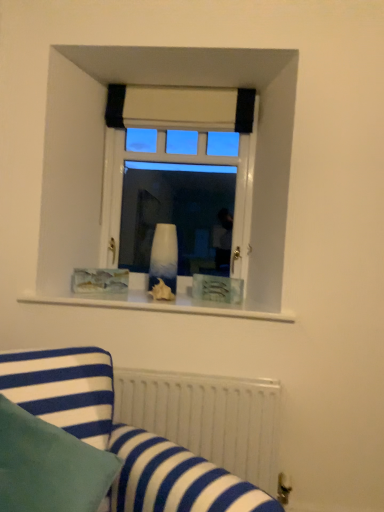
Question: Does blue striped fabric at lower left lie behind white matte radiator at lower center?

Choices:
 (A) no
 (B) yes

Answer: (A)

Question: Can we say blue striped fabric at lower left lies outside white matte radiator at lower center?

Choices:
 (A) no
 (B) yes

Answer: (B)

Question: From a real-world perspective, does blue striped fabric at lower left stand above white matte radiator at lower center?

Choices:
 (A) no
 (B) yes

Answer: (B)

Question: Is blue striped fabric at lower left positioned in front of white matte radiator at lower center?

Choices:
 (A) no
 (B) yes

Answer: (B)

Question: Is blue striped fabric at lower left aimed at white matte radiator at lower center?

Choices:
 (A) no
 (B) yes

Answer: (A)

Question: From a real-world perspective, is blue striped fabric at lower left located beneath white matte radiator at lower center?

Choices:
 (A) yes
 (B) no

Answer: (B)

Question: From a real-world perspective, is white glossy vase at center on blue striped fabric at lower left?

Choices:
 (A) no
 (B) yes

Answer: (B)

Question: Is white glossy vase at center not close to blue striped fabric at lower left?

Choices:
 (A) yes
 (B) no

Answer: (A)

Question: Considering the relative sizes of white glossy vase at center and blue striped fabric at lower left in the image provided, is white glossy vase at center thinner than blue striped fabric at lower left?

Choices:
 (A) no
 (B) yes

Answer: (B)

Question: Is white glossy vase at center outside blue striped fabric at lower left?

Choices:
 (A) no
 (B) yes

Answer: (B)

Question: Considering the relative sizes of white glossy vase at center and blue striped fabric at lower left in the image provided, is white glossy vase at center taller than blue striped fabric at lower left?

Choices:
 (A) yes
 (B) no

Answer: (A)

Question: Is white glossy vase at center at the left side of blue striped fabric at lower left?

Choices:
 (A) yes
 (B) no

Answer: (B)

Question: Could you tell me if white matte radiator at lower center is turned towards white glossy vase at center?

Choices:
 (A) no
 (B) yes

Answer: (A)